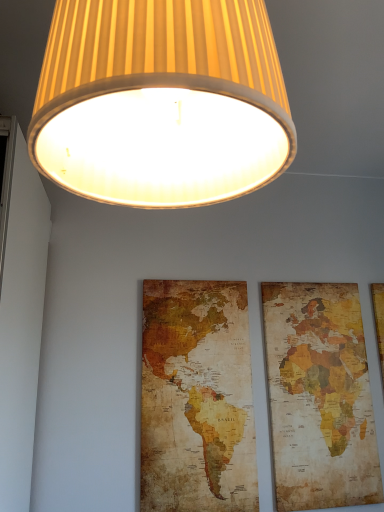
Question: Is vintage paper map at center wider or thinner than vintage paper map at right?

Choices:
 (A) thin
 (B) wide

Answer: (B)

Question: From the image's perspective, is vintage paper map at center located above or below vintage paper map at right?

Choices:
 (A) above
 (B) below

Answer: (A)

Question: Which is nearer to the vintage paper map at right?

Choices:
 (A) matte yellow fabric lampshade at upper center
 (B) vintage paper map at center

Answer: (B)

Question: Considering the real-world distances, which object is farthest from the vintage paper map at right?

Choices:
 (A) vintage paper map at center
 (B) matte yellow fabric lampshade at upper center

Answer: (B)